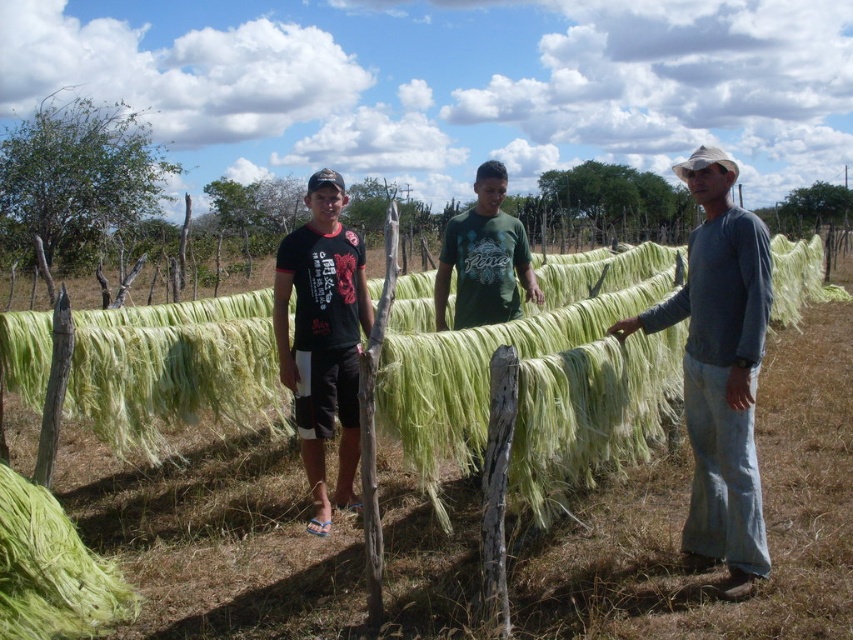
Is light blue denim jeans at right to the right of black matte t-shirt at center from the viewer's perspective?

Correct, you'll find light blue denim jeans at right to the right of black matte t-shirt at center.

Is light blue denim jeans at right below black matte t-shirt at center?

No.

I want to click on light blue denim jeans at right, so click(720, 371).

Image resolution: width=853 pixels, height=640 pixels. Describe the element at coordinates (720, 371) in the screenshot. I see `green fabric at center` at that location.

Does green fabric at center have a greater width compared to green leafy tree at upper center?

In fact, green fabric at center might be narrower than green leafy tree at upper center.

Describe the element at coordinates (720, 371) in the screenshot. I see `green fabric at center` at that location.

This screenshot has height=640, width=853. Find the location of `green fabric at center`. green fabric at center is located at coordinates (720, 371).

In the scene shown: Which is above, light blue denim jeans at right or green leafy tree at upper center?

green leafy tree at upper center is higher up.

Who is positioned more to the right, light blue denim jeans at right or green leafy tree at upper center?

Positioned to the right is green leafy tree at upper center.

Is point (753, 449) less distant than point (564, 198)?

That is True.

Find the location of `light blue denim jeans at right`. light blue denim jeans at right is located at coordinates (720, 371).